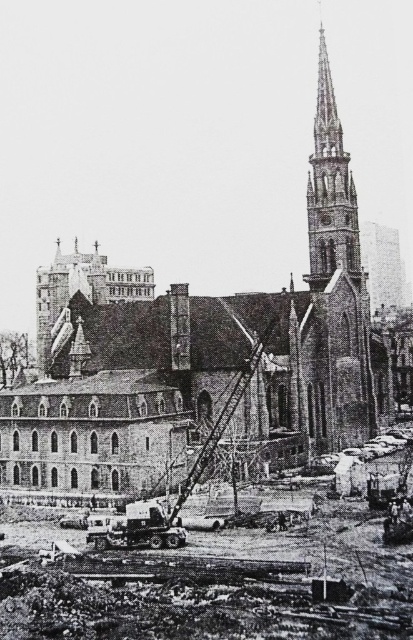
Question: Which point appears closest to the camera in this image?

Choices:
 (A) (318, 131)
 (B) (199, 602)

Answer: (B)

Question: Is concrete construction site at lower center thinner than polished stone spire at upper right?

Choices:
 (A) yes
 (B) no

Answer: (B)

Question: Which of the following is the farthest from the observer?

Choices:
 (A) concrete construction site at lower center
 (B) polished stone spire at upper right

Answer: (B)

Question: Can you confirm if concrete construction site at lower center is smaller than polished stone spire at upper right?

Choices:
 (A) no
 (B) yes

Answer: (A)

Question: Which object appears closest to the camera in this image?

Choices:
 (A) concrete construction site at lower center
 (B) polished stone spire at upper right

Answer: (A)

Question: Is concrete construction site at lower center above polished stone spire at upper right?

Choices:
 (A) no
 (B) yes

Answer: (A)